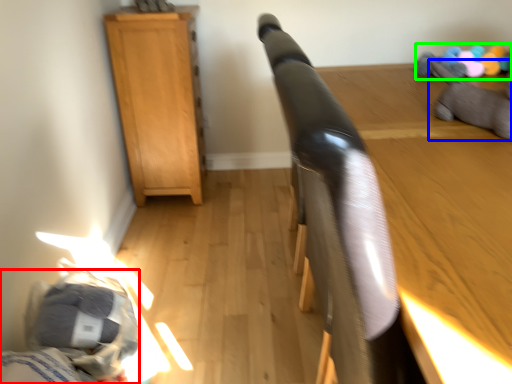
Question: Which object is the closest to the bed (highlighted by a red box)? Choose among these: animal (highlighted by a blue box) or toy (highlighted by a green box).

Choices:
 (A) animal
 (B) toy

Answer: (A)